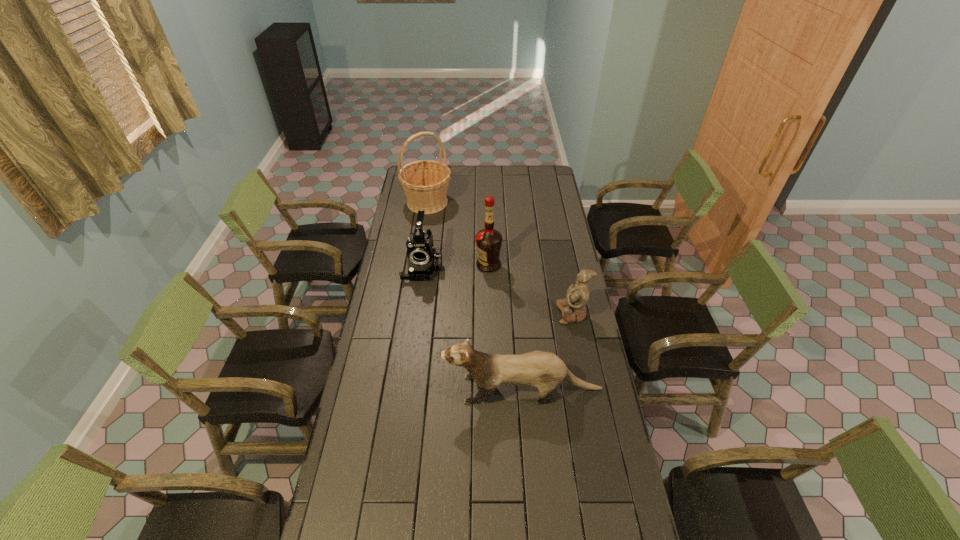
Locate an element on the screen. This screenshot has height=540, width=960. free space at the far edge is located at coordinates (501, 179).

Image resolution: width=960 pixels, height=540 pixels. Find the location of `free space at the left edge of the desktop`. free space at the left edge of the desktop is located at coordinates (368, 383).

In order to click on free region at the right edge of the desktop in this screenshot , I will do `click(561, 256)`.

Identify the location of free area in between the camcorder and the liquor. (456, 266).

Locate an element on the screen. This screenshot has width=960, height=540. empty location between the farthest object and the ferret is located at coordinates (475, 296).

Identify the location of free space between the nearest object and the camcorder. The width and height of the screenshot is (960, 540). (472, 328).

At what (x,y) coordinates should I click in order to perform the action: click on free space between the liquor and the camcorder. Please return your answer as a coordinate pair (x, y). This screenshot has width=960, height=540. Looking at the image, I should click on coord(456,266).

You are a GUI agent. You are given a task and a screenshot of the screen. Output one action in this format:
    pyautogui.click(x=<x>, y=<y>)
    Task: Click on the vacant space in between the liquor and the basket
    This screenshot has height=540, width=960.
    Given the screenshot: What is the action you would take?
    pyautogui.click(x=458, y=233)

Image resolution: width=960 pixels, height=540 pixels. I want to click on free space between the ferret and the liquor, so click(x=506, y=327).

Locate which object is the second closest to the basket. Please provide its 2D coordinates. Your answer should be formatted as a tuple, i.e. [(x, y)], where the tuple contains the x and y coordinates of a point satisfying the conditions above.

[(488, 241)]